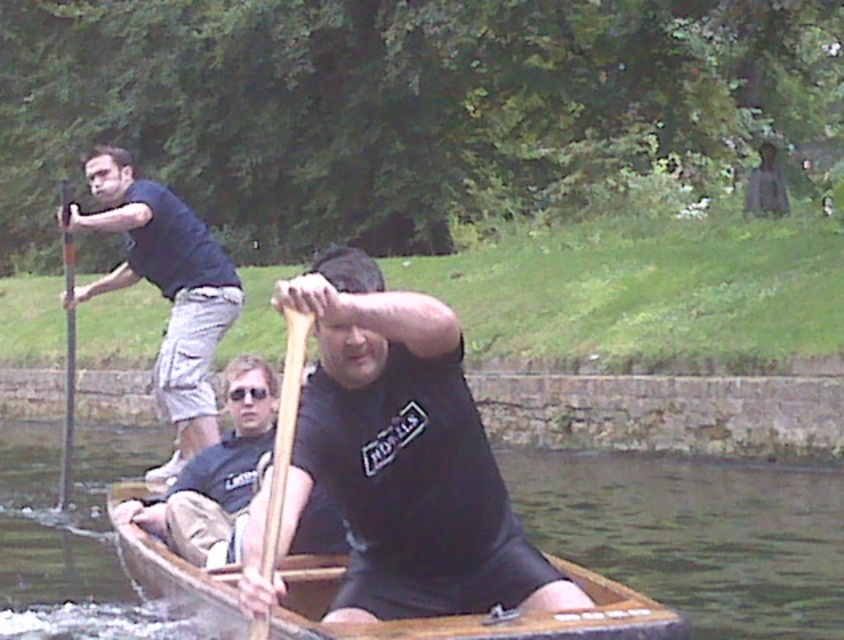
Is dark gray cotton shirt at center shorter than wooden paddle at left?

Correct, dark gray cotton shirt at center is not as tall as wooden paddle at left.

This screenshot has height=640, width=844. What do you see at coordinates (215, 474) in the screenshot?
I see `dark gray cotton shirt at center` at bounding box center [215, 474].

The width and height of the screenshot is (844, 640). I want to click on dark gray cotton shirt at center, so click(215, 474).

Can you confirm if dark blue t-shirt at left is shorter than wooden paddle at left?

In fact, dark blue t-shirt at left may be taller than wooden paddle at left.

Who is shorter, dark blue t-shirt at left or wooden paddle at left?

Standing shorter between the two is wooden paddle at left.

Does point (188, 428) lie in front of point (69, 429)?

Yes, point (188, 428) is in front of point (69, 429).

Find the location of a particular element. dark blue t-shirt at left is located at coordinates (165, 289).

In the scene shown: Does matte black oar at center have a larger size compared to dark blue t-shirt at left?

Actually, matte black oar at center might be smaller than dark blue t-shirt at left.

Which is behind, point (419, 344) or point (157, 278)?

The point (157, 278) is behind.

Who is more distant from viewer, (x=388, y=470) or (x=74, y=292)?

The point (x=74, y=292) is behind.

Identify the location of matte black oar at center. (404, 456).